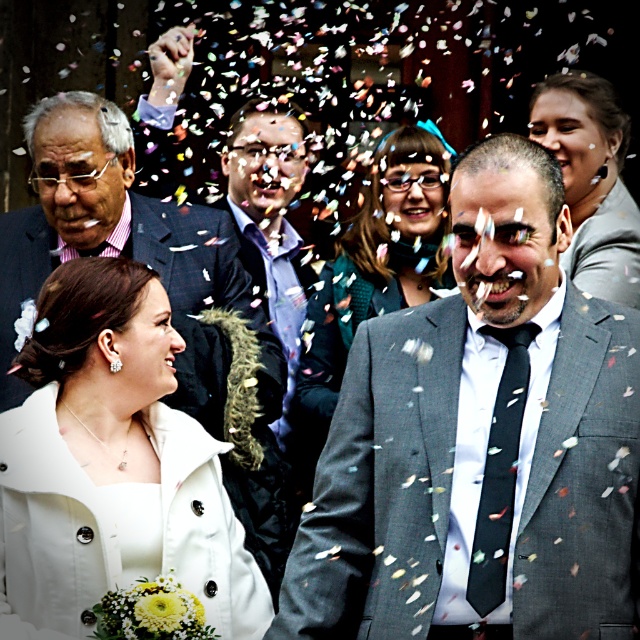
You are a photographer at the wedding. You need to adjust your camera to focus on both the white satin dress at lower left and the matte gray suit at upper right. Which one should you focus on first to ensure proper depth of field?

The white satin dress at lower left is much taller than the matte gray suit at upper right, so you should focus on the white satin dress at lower left first to ensure proper depth of field.

You are a photographer standing at the camera position. You want to take a closeup shot of the white satin dress at lower left. Can you estimate how far you need to move forward to get a closer shot?

The white satin dress at lower left is 18.53 meters away from the camera. To get a closer shot, you would need to move forward approximately 18.53 meters towards it.